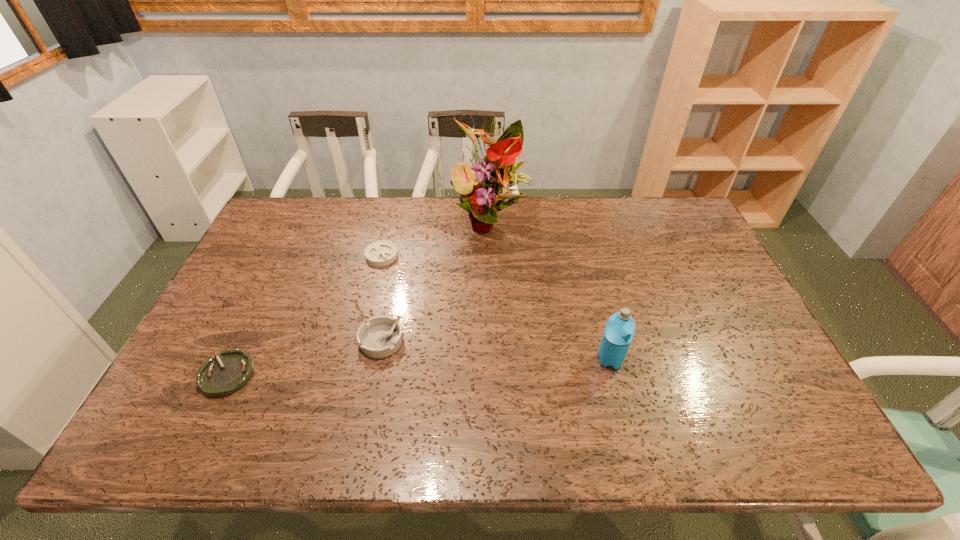
Where is `free space between the tallest object and the tallest ashtray`? The image size is (960, 540). free space between the tallest object and the tallest ashtray is located at coordinates (436, 280).

Locate an element on the screen. free space that is in between the leftmost object and the bouquet is located at coordinates (359, 298).

In order to click on vacant space in between the farthest ashtray and the fourth object from left to right in this screenshot , I will do `click(436, 238)`.

The image size is (960, 540). In order to click on vacant point located between the leftmost ashtray and the second object from right to left in this screenshot , I will do `click(359, 298)`.

At what (x,y) coordinates should I click in order to perform the action: click on vacant space that's between the farthest ashtray and the fourth shortest object. Please return your answer as a coordinate pair (x, y). Looking at the image, I should click on (496, 307).

Identify the location of free space between the rightmost object and the tallest ashtray. (495, 350).

Locate an element on the screen. This screenshot has width=960, height=540. vacant space that is in between the leftmost object and the second object from right to left is located at coordinates (359, 298).

Where is `unoccupied area between the farthest ashtray and the leftmost ashtray`? The width and height of the screenshot is (960, 540). unoccupied area between the farthest ashtray and the leftmost ashtray is located at coordinates (304, 315).

Identify the location of free space between the leftmost ashtray and the rightmost object. (419, 367).

At what (x,y) coordinates should I click in order to perform the action: click on object that is the fourth closest to the tallest ashtray. Please return your answer as a coordinate pair (x, y). The image size is (960, 540). Looking at the image, I should click on (618, 333).